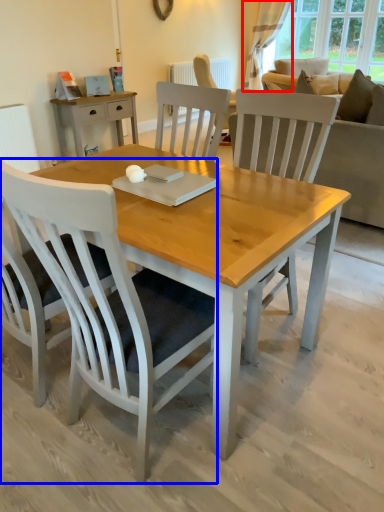
Question: Among these objects, which one is nearest to the camera, curtain (highlighted by a red box) or chair (highlighted by a blue box)?

Choices:
 (A) curtain
 (B) chair

Answer: (B)